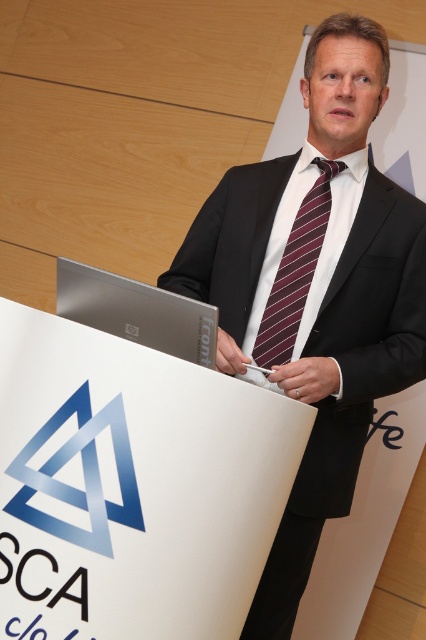
Is black silk suit at center to the right of maroon striped tie at center from the viewer's perspective?

Incorrect, black silk suit at center is not on the right side of maroon striped tie at center.

Can you confirm if black silk suit at center is thinner than maroon striped tie at center?

Incorrect, black silk suit at center's width is not less than maroon striped tie at center's.

Is point (345, 198) closer to viewer compared to point (270, 324)?

No, it is not.

The width and height of the screenshot is (426, 640). I want to click on black silk suit at center, so click(x=316, y=291).

Between black silk suit at center and silver metallic laptop at center, which one has less height?

silver metallic laptop at center is shorter.

Which is more to the right, black silk suit at center or silver metallic laptop at center?

black silk suit at center is more to the right.

Is point (324, 323) positioned before point (150, 333)?

No.

Locate an element on the screen. This screenshot has height=640, width=426. black silk suit at center is located at coordinates (316, 291).

Is silver metallic laptop at center thinner than maroon striped tie at center?

No, silver metallic laptop at center is not thinner than maroon striped tie at center.

Does point (118, 305) come behind point (279, 266)?

No, (118, 305) is closer to viewer.

Locate an element on the screen. silver metallic laptop at center is located at coordinates (137, 310).